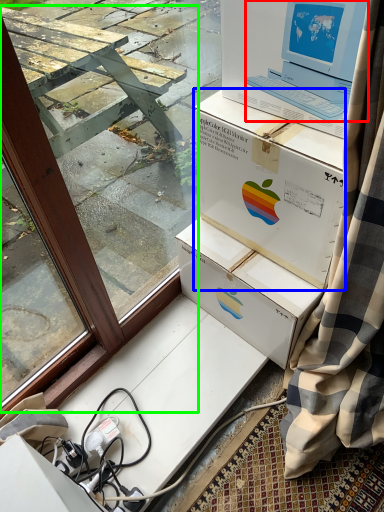
Question: Considering the real-world distances, which object is farthest from laptop (highlighted by a red box)? box (highlighted by a blue box) or window frame (highlighted by a green box)?

Choices:
 (A) box
 (B) window frame

Answer: (B)